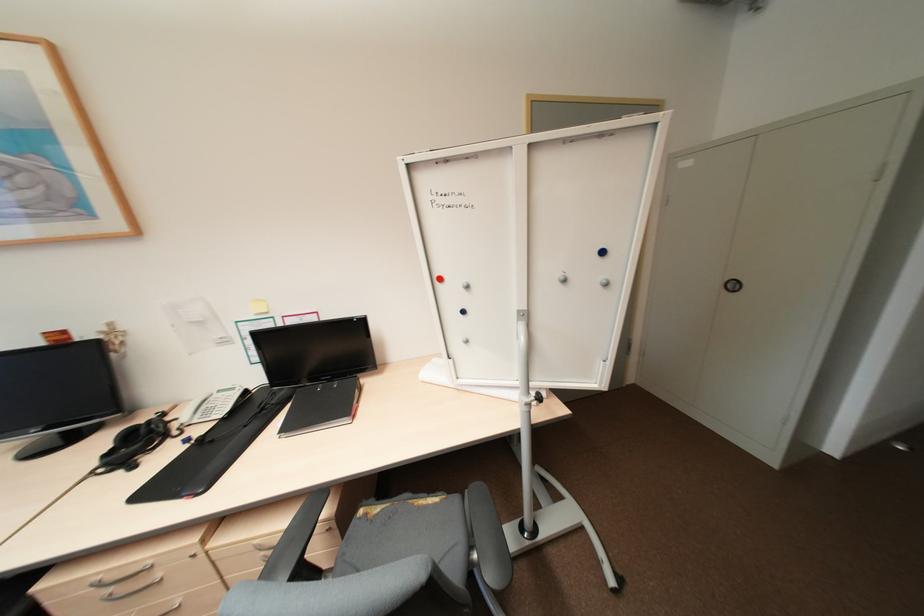
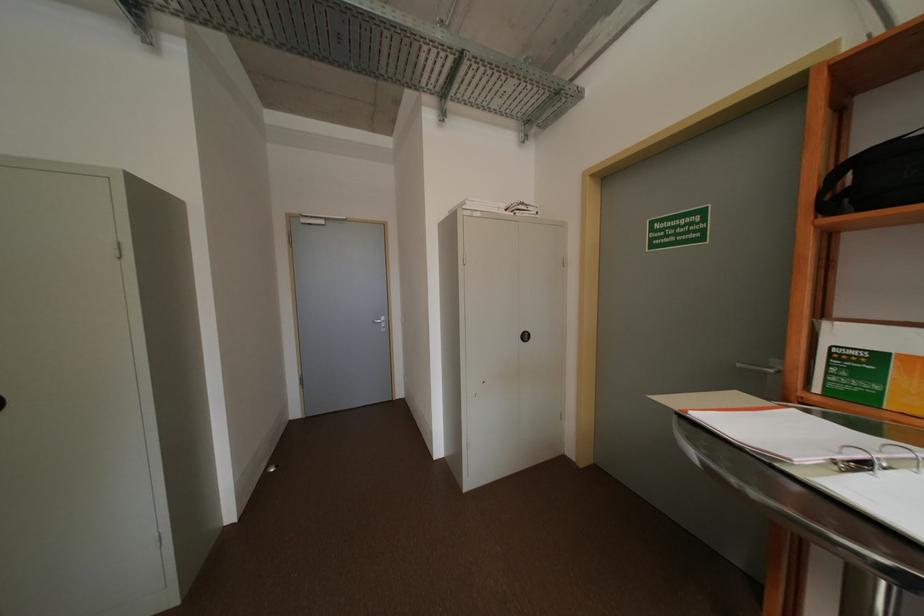
Question: The images are taken continuously from a first-person perspective. In which direction is your viewpoint rotating?

Choices:
 (A) Left
 (B) Right
 (C) Up
 (D) Down

Answer: (B)